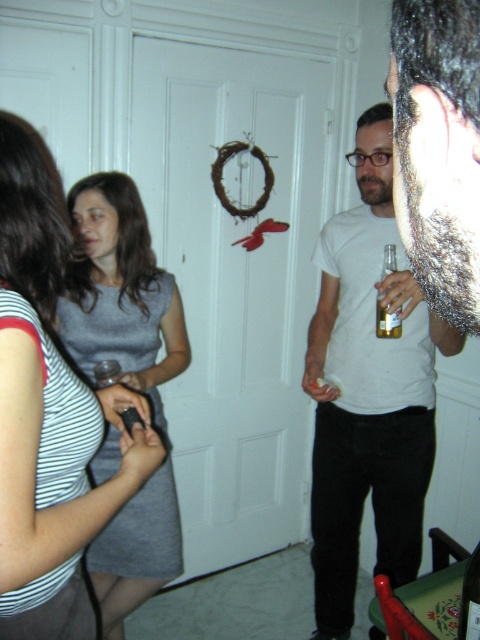
Between gray matte dress at center and clear glass bottle at center, which one has less height?

Standing shorter between the two is clear glass bottle at center.

Who is positioned more to the right, gray matte dress at center or clear glass bottle at center?

Positioned to the right is clear glass bottle at center.

Locate an element on the screen. Image resolution: width=480 pixels, height=640 pixels. gray matte dress at center is located at coordinates (120, 292).

Identify the location of white matte t-shirt at center. (369, 390).

Does white matte t-shirt at center appear under gray matte dress at center?

Incorrect, white matte t-shirt at center is not positioned below gray matte dress at center.

At what (x,y) coordinates should I click in order to perform the action: click on white matte t-shirt at center. Please return your answer as a coordinate pair (x, y). This screenshot has width=480, height=640. Looking at the image, I should click on (369, 390).

Does white matte t-shirt at center have a greater width compared to clear glass bottle at center?

Yes, white matte t-shirt at center is wider than clear glass bottle at center.

From the picture: Does white matte t-shirt at center lie behind clear glass bottle at center?

That is False.

Which is in front, point (411, 513) or point (388, 259)?

Point (388, 259) is in front.

You are a GUI agent. You are given a task and a screenshot of the screen. Output one action in this format:
    pyautogui.click(x=<x>, y=<y>)
    Task: Click on the white matte t-shirt at center
    The height and width of the screenshot is (640, 480).
    Given the screenshot: What is the action you would take?
    pyautogui.click(x=369, y=390)